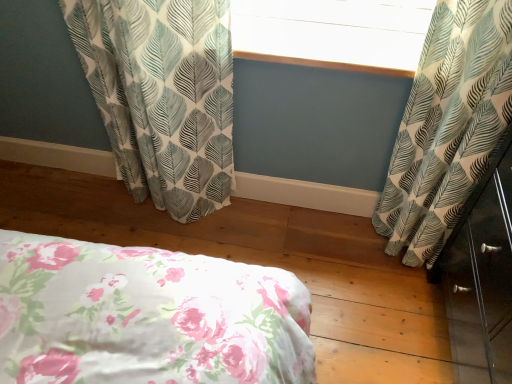
Locate an element on the screen. The height and width of the screenshot is (384, 512). empty space that is in between white leaf-patterned curtain at left, marked as the first curtain in a left-to-right arrangement, and white leaf-patterned curtain at right, which ranks as the first curtain in right-to-left order is located at coordinates (293, 230).